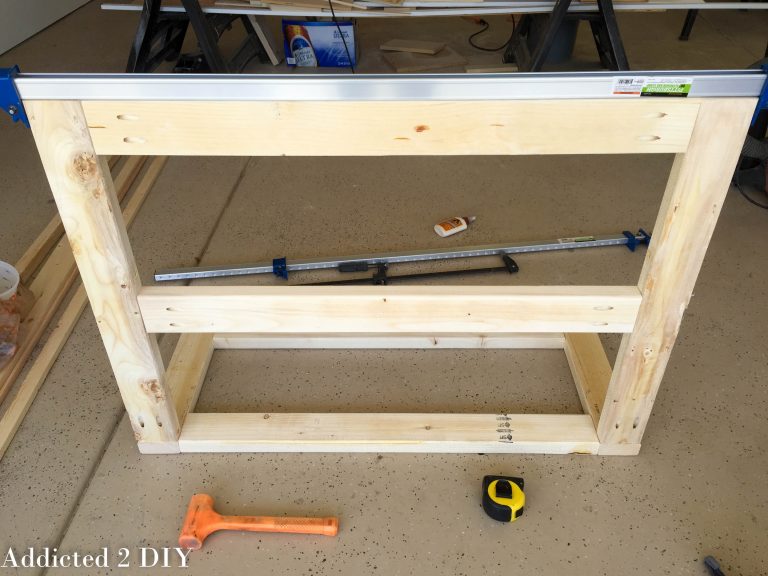
The image size is (768, 576). Identify the location of sticker. (650, 92).